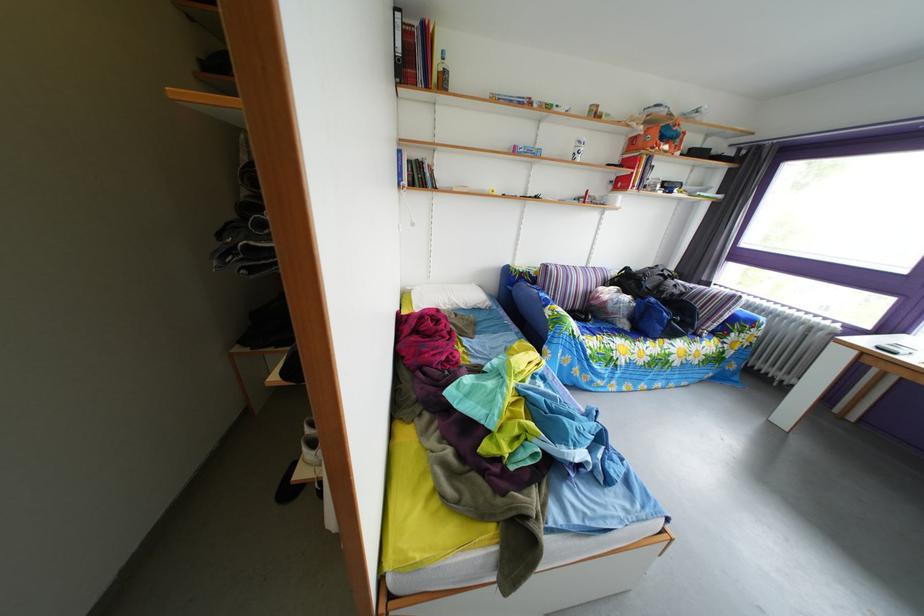
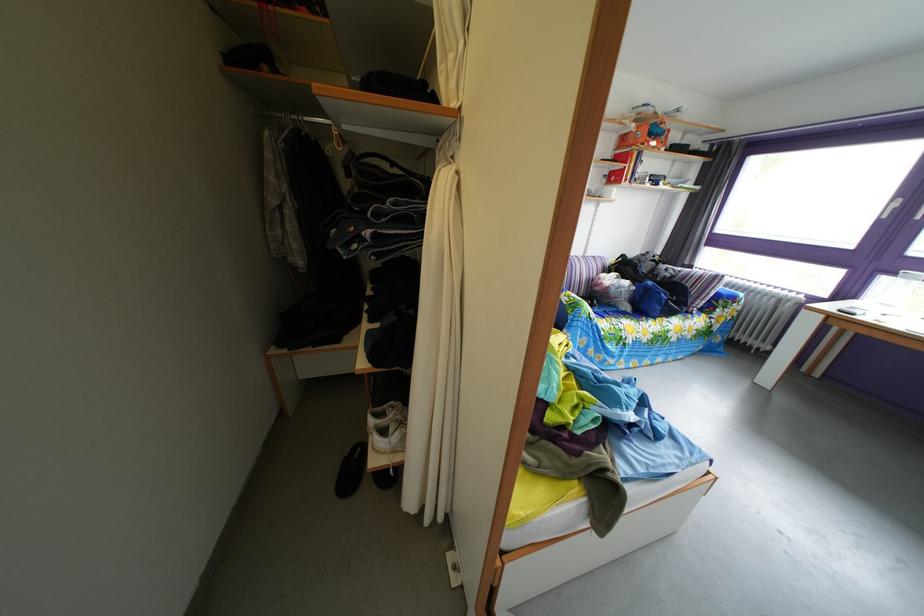
Locate, in the second image, the point that corresponds to [599,270] in the first image.

(596, 261)